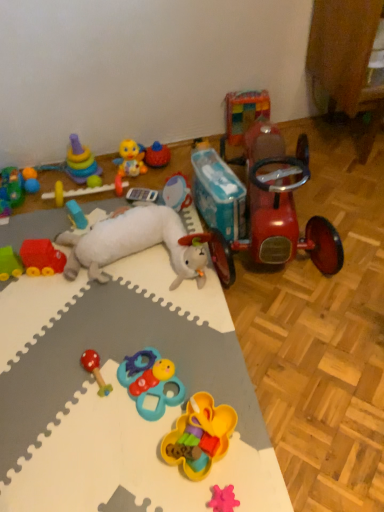
Find the location of a particular element. vacant space behind rubberized yellow flower-shaped toy at center, the tenth toy in the left-to-right sequence is located at coordinates (214, 361).